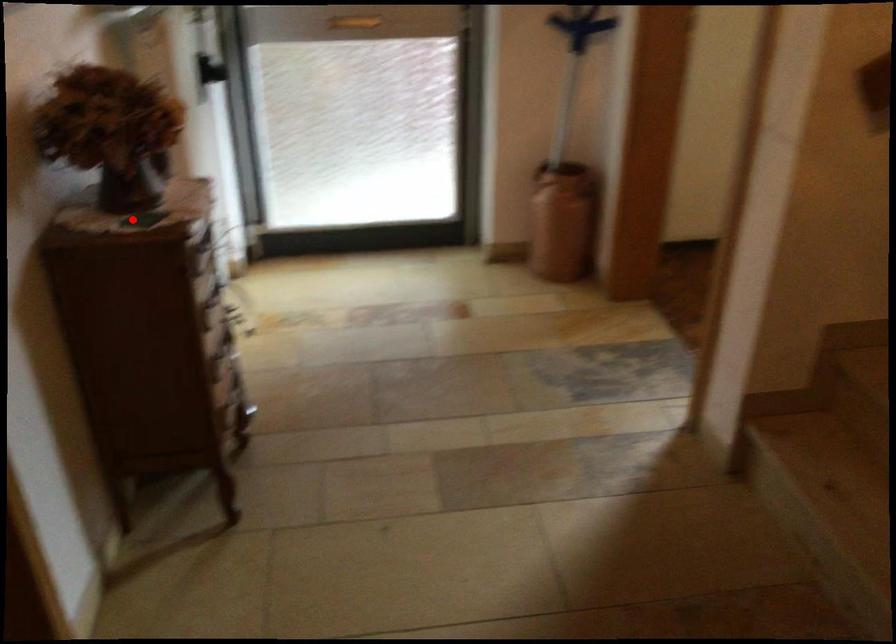
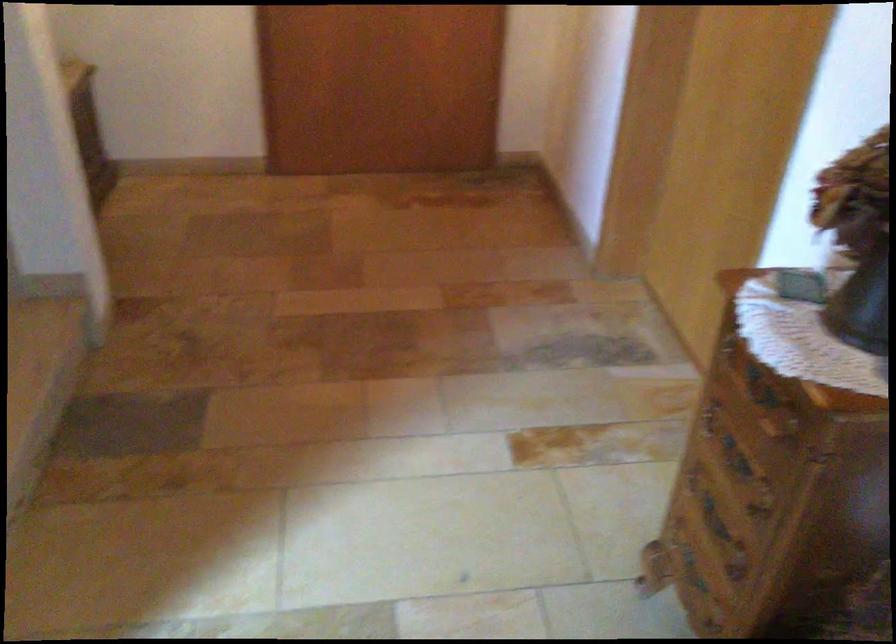
Question: I am providing you with two images of the same scene from different viewpoints. Given a red point in image1, look at the same physical point in image2. Is it:

Choices:
 (A) Closer to the viewpoint
 (B) Farther from the viewpoint

Answer: (A)